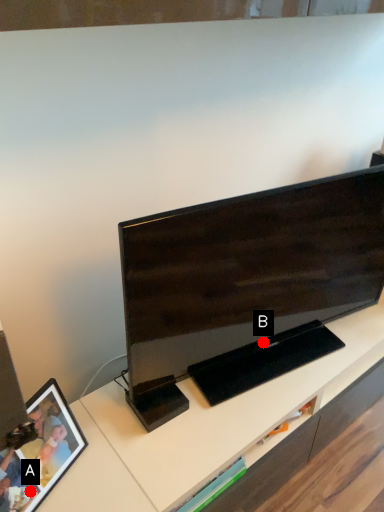
Question: Two points are circled on the image, labeled by A and B beside each circle. Which point appears farthest from the camera in this image?

Choices:
 (A) A is further
 (B) B is further

Answer: (B)